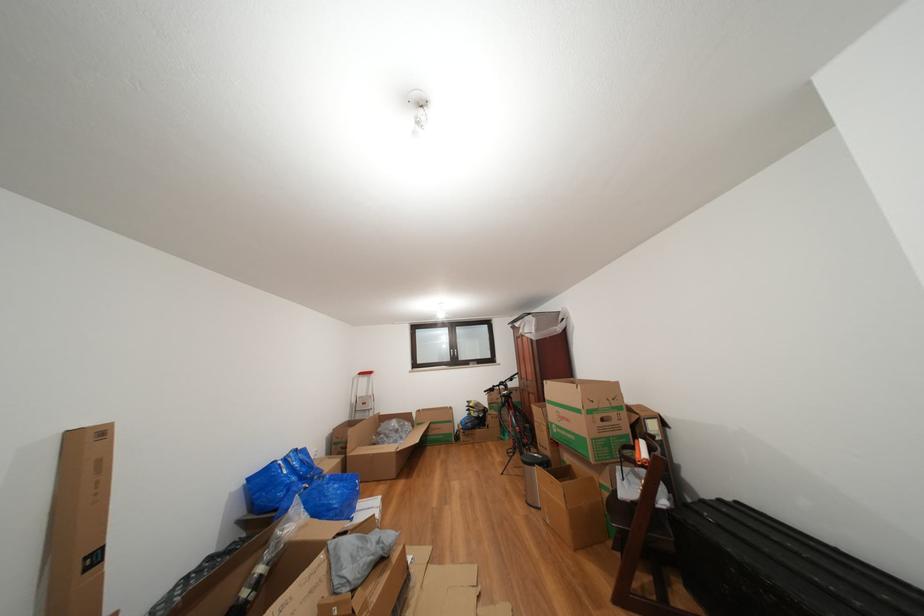
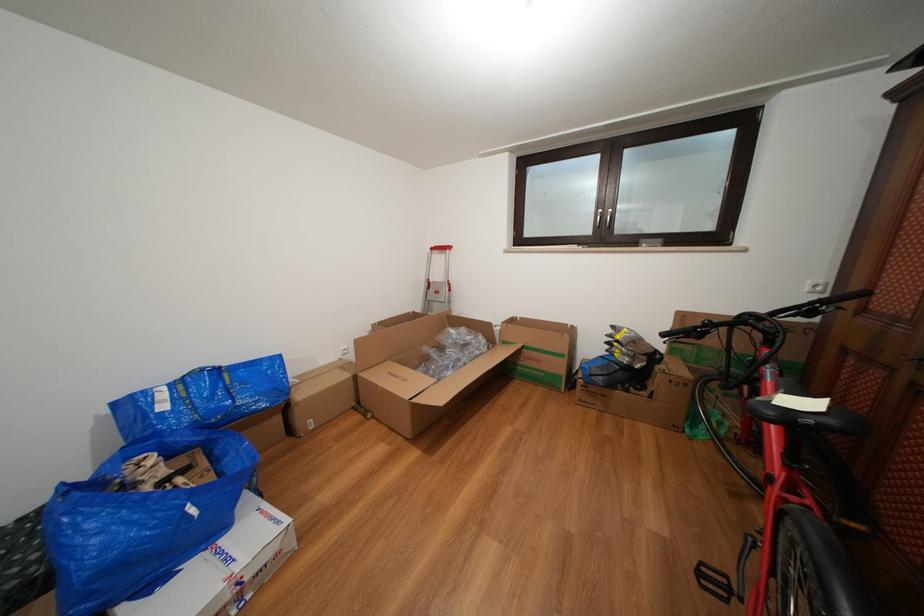
Where in the second image is the point corresponding to point 458,427 from the first image?

(570, 361)